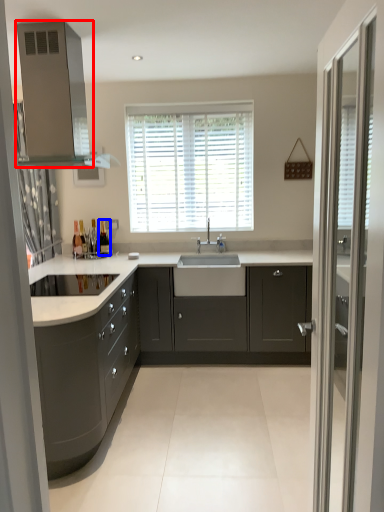
Question: Which object is closer to the camera taking this photo, vent (highlighted by a red box) or bottle (highlighted by a blue box)?

Choices:
 (A) vent
 (B) bottle

Answer: (A)